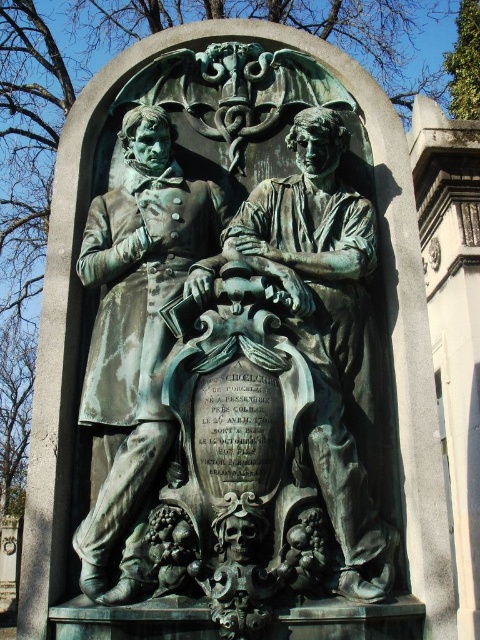
You are a historian examining the bronze relief sculpture mounted on a stone pedestal in a cemetery. You notice a point at coordinates (237, 344). What object is located at this point?

The bronze statue at center is located at point (237, 344).

Looking at this image, you are standing in front of the bronze relief sculpture and notice two points marked on the image. The first point is at coordinate point (146,240) and the second is at point (156,118). Which point is closer to you?

Point (146,240) is closer to the camera than point (156,118).

You are a tour guide explaining the sculptures in the cemetery. You mention both the bronze statue at center and the green patina statue at left. Which one should you point to if you want to highlight the larger one?

The bronze statue at center is bigger than the green patina statue at left, so you should point to the bronze statue at center to highlight the larger one.